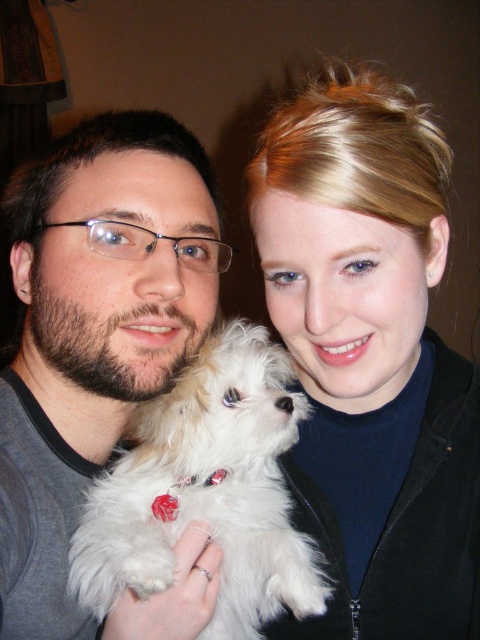
Question: Among these points, which one is farthest from the camera?

Choices:
 (A) (72, 147)
 (B) (249, 476)

Answer: (A)

Question: Does matte white dog at upper right have a larger size compared to matte gray shirt at center?

Choices:
 (A) yes
 (B) no

Answer: (B)

Question: Which object is farther from the camera taking this photo?

Choices:
 (A) white fluffy dog at center
 (B) matte white dog at upper right

Answer: (B)

Question: Does matte white dog at upper right appear on the left side of white fluffy dog at center?

Choices:
 (A) no
 (B) yes

Answer: (A)

Question: Observing the image, what is the correct spatial positioning of matte white dog at upper right in reference to matte gray shirt at center?

Choices:
 (A) left
 (B) right

Answer: (B)

Question: Which point appears farthest from the camera in this image?

Choices:
 (A) tap(48, 257)
 (B) tap(472, 618)

Answer: (A)